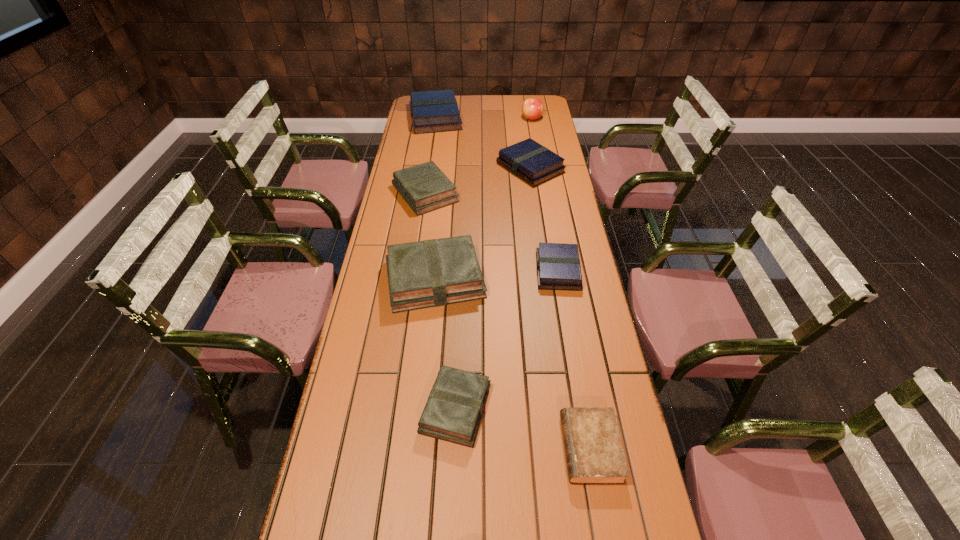
Locate an element on the screen. This screenshot has width=960, height=540. apple is located at coordinates (532, 108).

Locate an element on the screen. the biggest blue book is located at coordinates (431, 111).

I want to click on the farthest book, so click(431, 111).

The width and height of the screenshot is (960, 540). What are the coordinates of `the second nearest greenish book` in the screenshot? It's located at (436, 272).

Locate an element on the screen. The image size is (960, 540). the second biggest blue book is located at coordinates (535, 164).

Find the location of a particular element. the second biggest greenish book is located at coordinates (424, 187).

The height and width of the screenshot is (540, 960). I want to click on the smallest blue book, so click(x=558, y=267).

At what (x,y) coordinates should I click in order to perform the action: click on the nearest book. Please return your answer as a coordinate pair (x, y). The width and height of the screenshot is (960, 540). Looking at the image, I should click on (455, 405).

Where is `the smallest greenish book`? Image resolution: width=960 pixels, height=540 pixels. the smallest greenish book is located at coordinates (455, 405).

You are a GUI agent. You are given a task and a screenshot of the screen. Output one action in this format:
    pyautogui.click(x=<x>, y=<y>)
    Task: Click on the diary
    This screenshot has width=960, height=540.
    Given the screenshot: What is the action you would take?
    pyautogui.click(x=594, y=454)